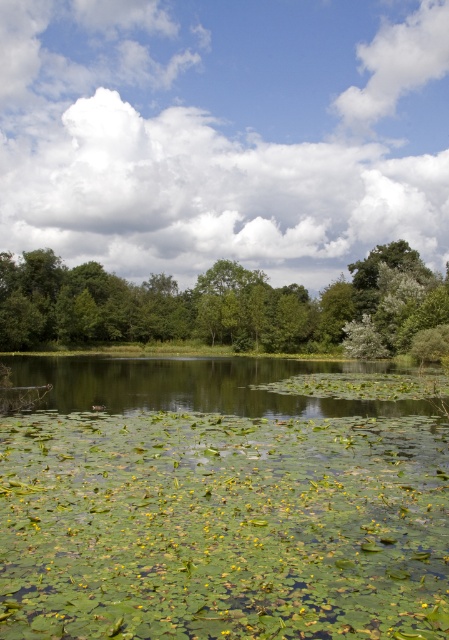
Who is taller, green leafy water at center or green leafy tree at center?

green leafy tree at center is taller.

Looking at this image, is green leafy water at center thinner than green leafy tree at center?

Correct, green leafy water at center's width is less than green leafy tree at center's.

Locate an element on the screen. The image size is (449, 640). green leafy water at center is located at coordinates (223, 500).

This screenshot has height=640, width=449. Identify the location of green leafy water at center. (223, 500).